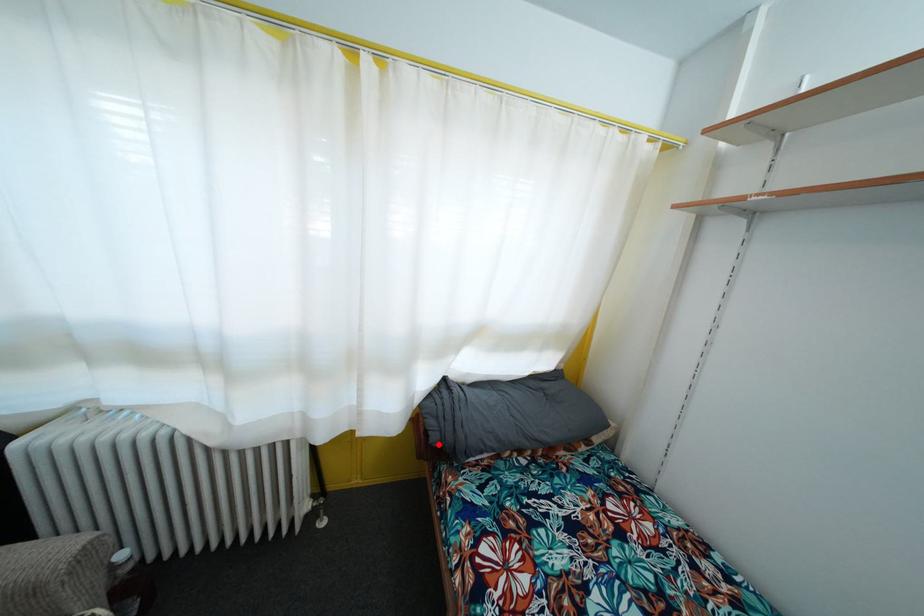
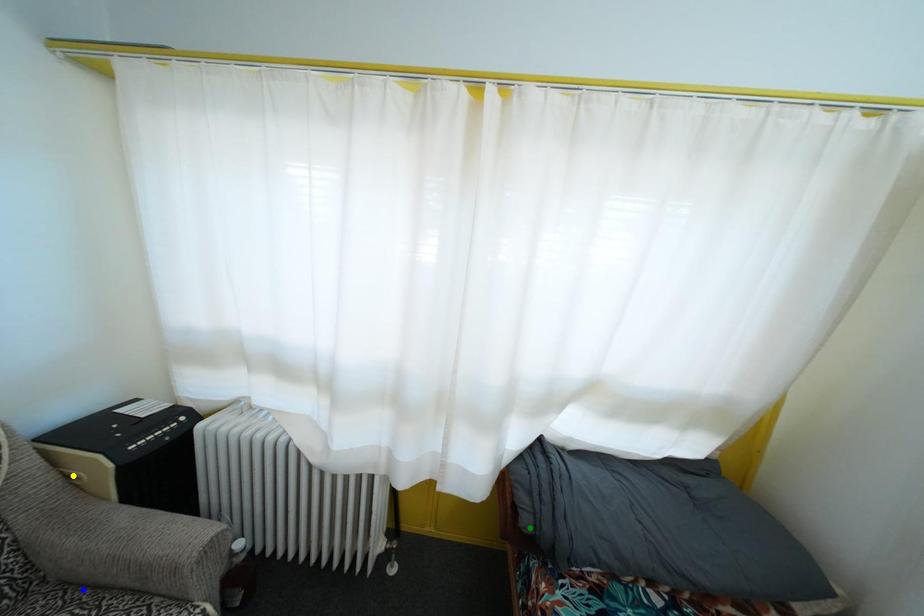
Question: I am providing you with two images of the same scene from different viewpoints. A red point is marked on the first image. You are given multiple points on the second image. In image 2, which mark is for the same physical point as the one in image 1?

Choices:
 (A) yellow point
 (B) blue point
 (C) green point

Answer: (C)